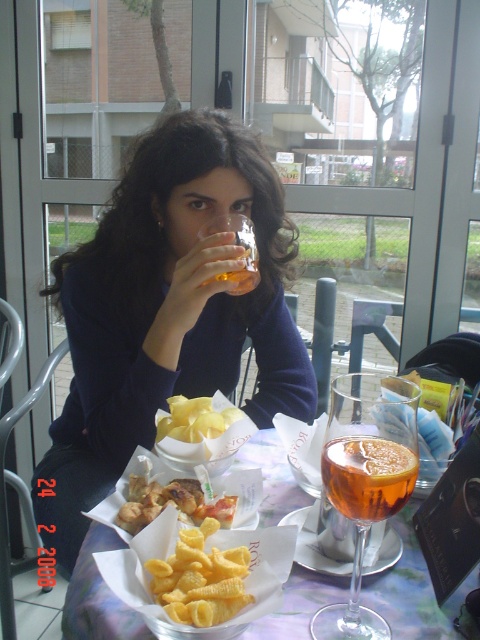
Question: Does yellow crispy pasta at center have a lesser width compared to golden crispy fries at center?

Choices:
 (A) yes
 (B) no

Answer: (A)

Question: Estimate the real-world distances between objects in this image. Which object is farther from the metallic silver tray at center?

Choices:
 (A) translucent glass at center
 (B) yellow crispy pasta at center
 (C) translucent glass drink at center

Answer: (C)

Question: Can you confirm if matte black sweater at center is positioned to the right of translucent glass at center?

Choices:
 (A) no
 (B) yes

Answer: (A)

Question: Which is farther from the golden crispy fries at center?

Choices:
 (A) yellow matte chips at center
 (B) translucent glass at center
 (C) yellow crispy pasta at center
 (D) translucent glass drink at center

Answer: (D)

Question: From the image, what is the correct spatial relationship of translucent glass at center in relation to golden crispy fries at center?

Choices:
 (A) below
 (B) above

Answer: (B)

Question: Which of the following is the closest to the observer?

Choices:
 (A) (178, 397)
 (B) (134, 515)
 (C) (199, 627)

Answer: (C)